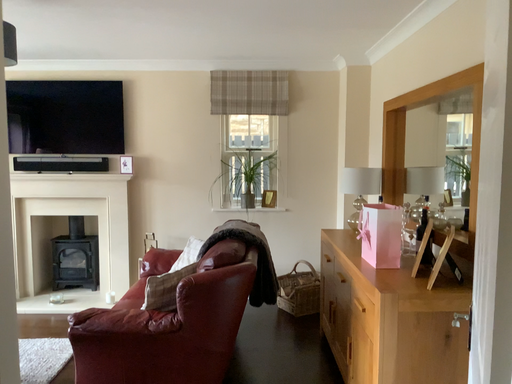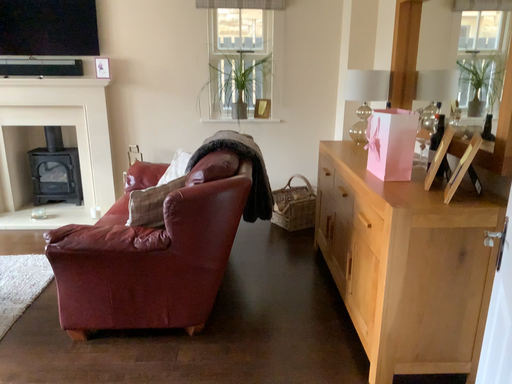
Question: Which way did the camera rotate in the video?

Choices:
 (A) rotated upward
 (B) rotated downward

Answer: (B)